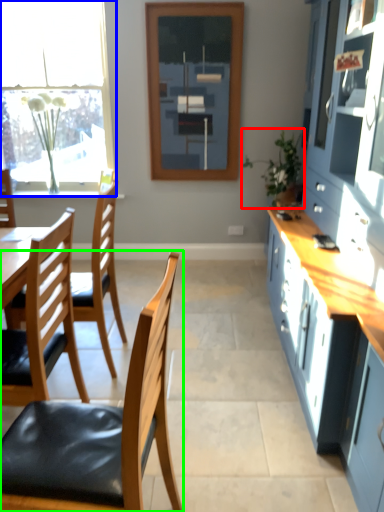
Question: Which object is the farthest from houseplant (highlighted by a red box)? Choose among these: window (highlighted by a blue box) or chair (highlighted by a green box).

Choices:
 (A) window
 (B) chair

Answer: (B)